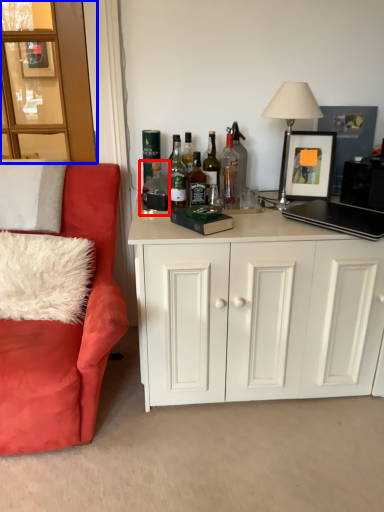
Question: Which point is further to the camera, bottle (highlighted by a red box) or glass door (highlighted by a blue box)?

Choices:
 (A) bottle
 (B) glass door

Answer: (A)